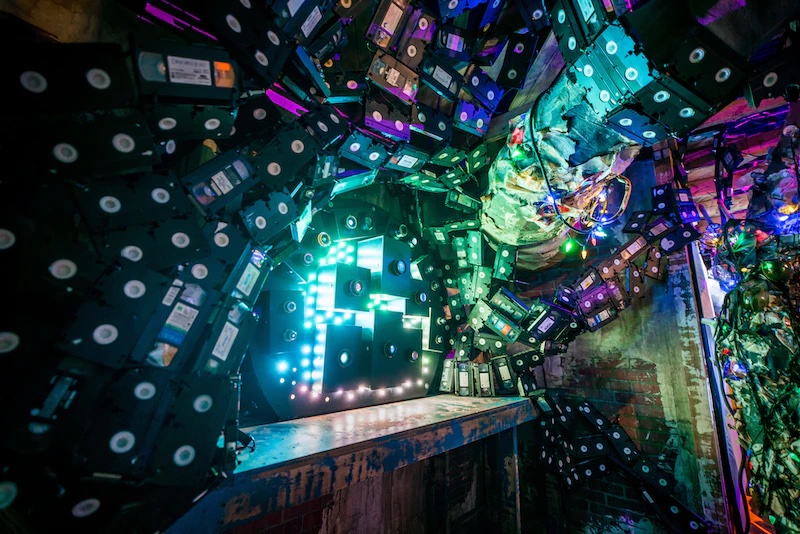
Image resolution: width=800 pixels, height=534 pixels. Find the location of `top of counter`. top of counter is located at coordinates (334, 431).